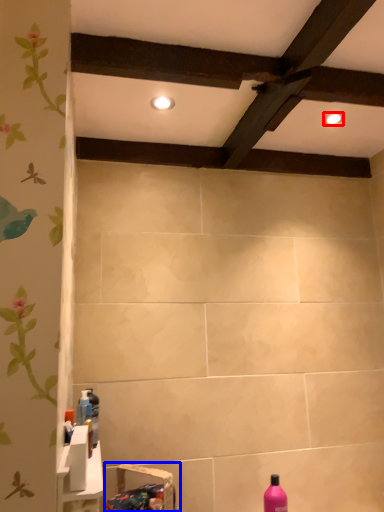
Question: Which object is closer to the camera taking this photo, lighting (highlighted by a red box) or sink (highlighted by a blue box)?

Choices:
 (A) lighting
 (B) sink

Answer: (B)